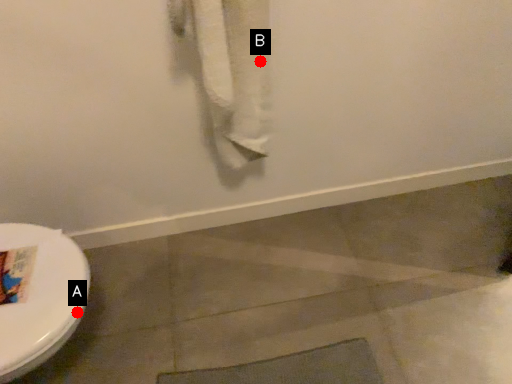
Question: Two points are circled on the image, labeled by A and B beside each circle. Which point is further to the camera?

Choices:
 (A) A is further
 (B) B is further

Answer: (B)